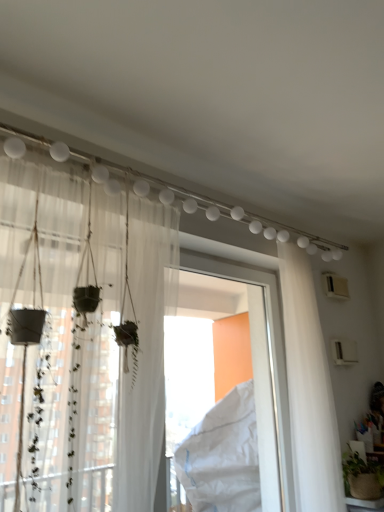
Question: Is white sheer curtain at right, the 1th curtain viewed from the back, to the left or to the right of sheer white curtain at left, the second curtain when ordered from right to left, in the image?

Choices:
 (A) left
 (B) right

Answer: (B)

Question: From a real-world perspective, is white sheer curtain at right, which ranks as the first curtain in right-to-left order, physically located above or below sheer white curtain at left, the second curtain when ordered from right to left?

Choices:
 (A) below
 (B) above

Answer: (A)

Question: Which object is the farthest from the sheer white curtain at left, marked as the first curtain in a front-to-back arrangement?

Choices:
 (A) white sheer curtain at right, the second curtain in the left-to-right sequence
 (B) white plastic window frame at center

Answer: (A)

Question: Which object is the farthest from the white plastic window frame at center?

Choices:
 (A) sheer white curtain at left, marked as the first curtain in a front-to-back arrangement
 (B) white sheer curtain at right, the 1th curtain viewed from the back

Answer: (A)